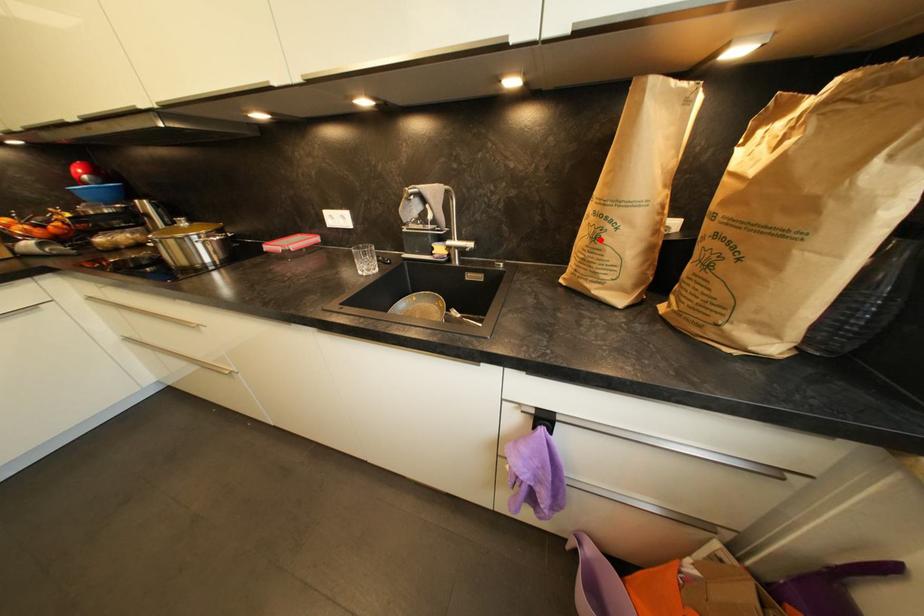
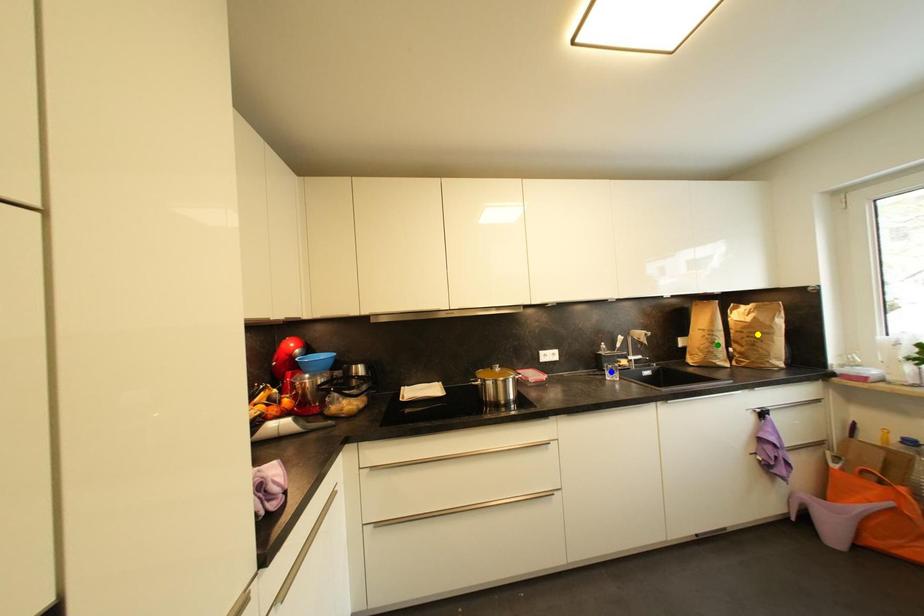
Question: I am providing you with two images of the same scene from different viewpoints. A red point is marked on the first image. You are given multiple points on the second image. Which point in image 2 represents the same 3d spot as the red point in image 1?

Choices:
 (A) yellow point
 (B) blue point
 (C) green point

Answer: (C)